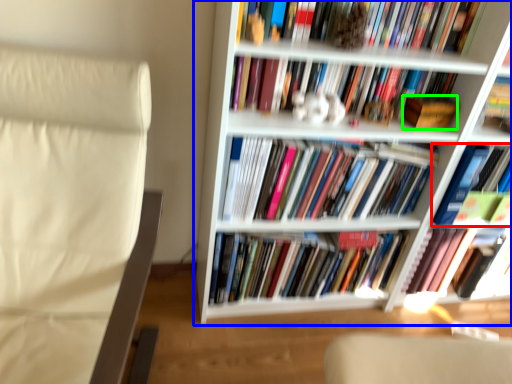
Question: Which object is positioned farthest from book (highlighted by a red box)? Select from bookcase (highlighted by a blue box) and paperback book (highlighted by a green box).

Choices:
 (A) bookcase
 (B) paperback book

Answer: (A)